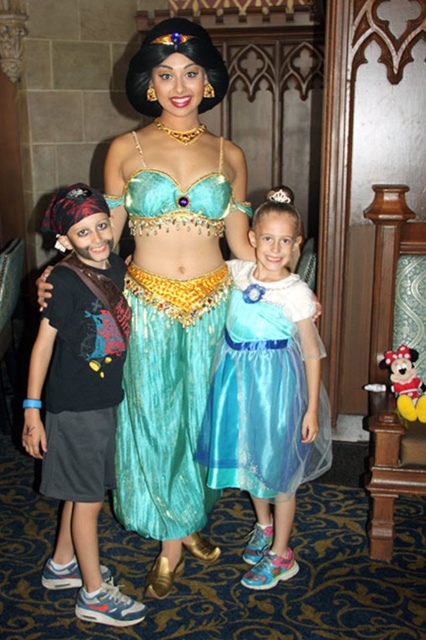
Question: Which of the following is the closest to the observer?

Choices:
 (A) (143, 179)
 (B) (184, 337)
 (C) (284, 316)
 (D) (97, 380)

Answer: (D)

Question: Where is shiny teal dress at center located in relation to dark gray cotton shorts at left in the image?

Choices:
 (A) right
 (B) left

Answer: (A)

Question: Which point is closer to the camera taking this photo?

Choices:
 (A) (281, 337)
 (B) (65, 506)
 (C) (166, 269)
 (D) (169, 454)

Answer: (C)

Question: Which point is closer to the camera taking this photo?

Choices:
 (A) (201, 384)
 (B) (51, 460)
 (C) (164, 188)
 (D) (279, 522)

Answer: (C)

Question: Can you confirm if shiny teal dress at center is positioned to the left of shiny teal fabric at center?

Choices:
 (A) yes
 (B) no

Answer: (B)

Question: Is shiny teal dress at center wider than shiny teal fabric at center?

Choices:
 (A) yes
 (B) no

Answer: (A)